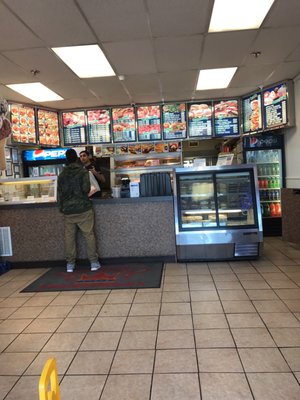
Where is `cooler for beverages`? The image size is (300, 400). cooler for beverages is located at coordinates (267, 160).